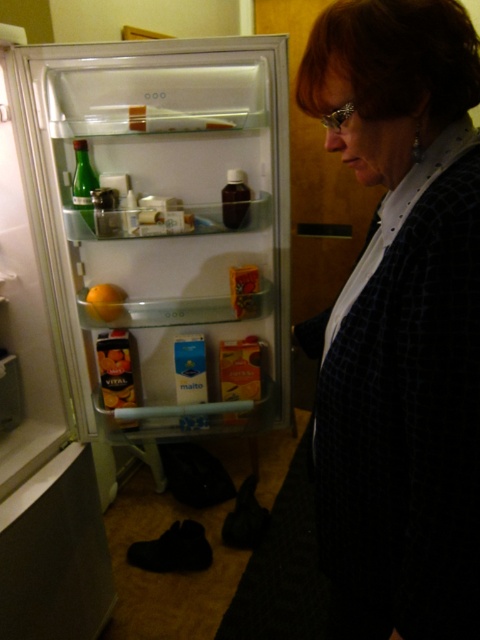
You are standing in a kitchen and want to reach the clear glass refrigerator at center. What is the exact coordinate point where you should aim to reach it?

The clear glass refrigerator at center is located at the coordinate point of [163,230].